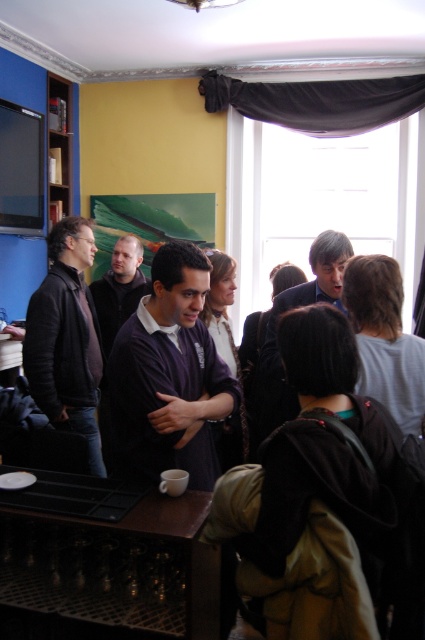
Question: Can you confirm if purple sweater at center is wider than dark blue suit at center?

Choices:
 (A) yes
 (B) no

Answer: (A)

Question: Which object appears farthest from the camera in this image?

Choices:
 (A) dark brown leather jacket at left
 (B) purple sweater at center
 (C) matte black shirt at center
 (D) dark blue suit at center

Answer: (C)

Question: Which is farther from the dark brown leather jacket at left?

Choices:
 (A) matte black shirt at center
 (B) purple sweater at center
 (C) dark blue suit at center

Answer: (C)

Question: Is purple sweater at center closer to the viewer compared to dark brown leather jacket at left?

Choices:
 (A) yes
 (B) no

Answer: (A)

Question: Which point is farther from the camera taking this photo?

Choices:
 (A) (274, 384)
 (B) (25, 368)
 (C) (198, 346)

Answer: (B)

Question: Considering the relative positions of dark brown leather jacket at left and matte black shirt at center in the image provided, where is dark brown leather jacket at left located with respect to matte black shirt at center?

Choices:
 (A) left
 (B) right

Answer: (A)